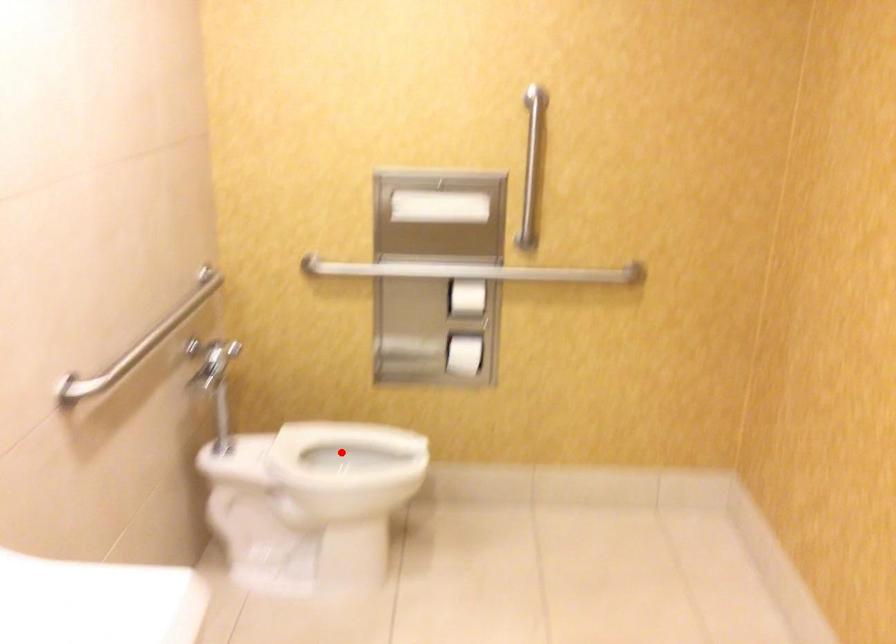
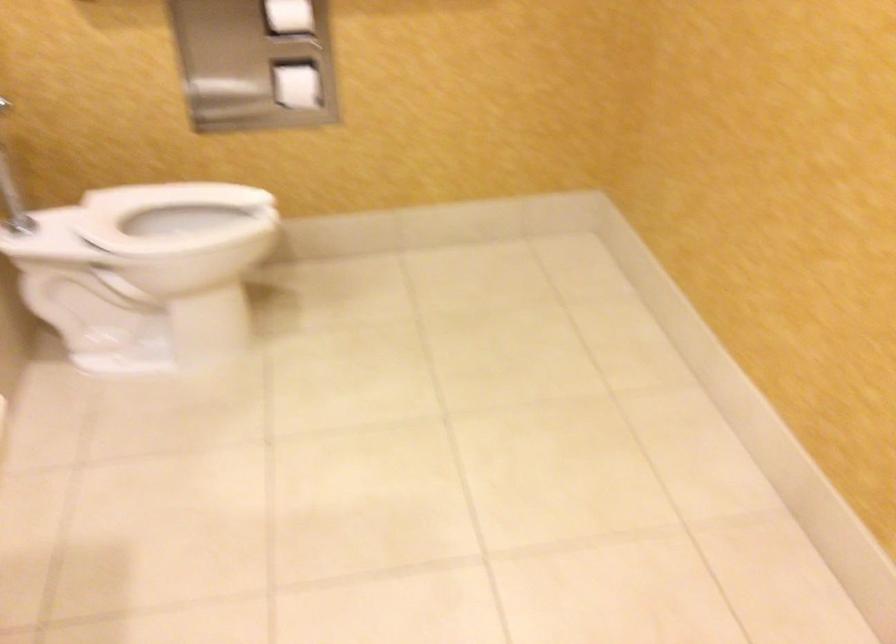
Question: I am providing you with two images of the same scene from different viewpoints. A red point is shown in image1. For the corresponding object point in image2, is it positioned nearer or farther from the camera?

Choices:
 (A) Nearer
 (B) Farther

Answer: (A)